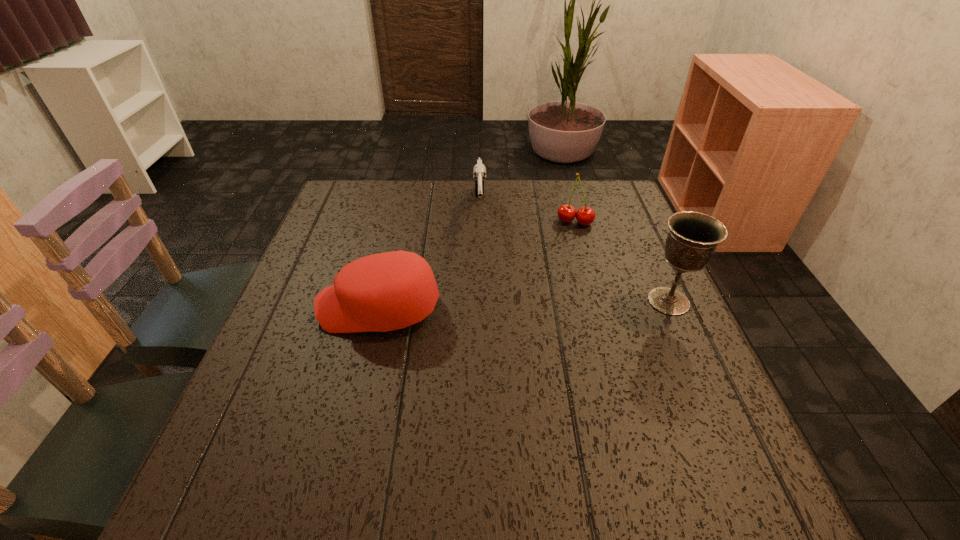
At what (x,y) coordinates should I click in order to perform the action: click on vacant space situated at the muzzle of the second object from left to right. Please return your answer as a coordinate pair (x, y). This screenshot has height=540, width=960. Looking at the image, I should click on (483, 284).

Where is `vacant space situated 0.220m at the muzzle of the second object from left to right`? The height and width of the screenshot is (540, 960). vacant space situated 0.220m at the muzzle of the second object from left to right is located at coordinates (484, 292).

Locate an element on the screen. cherry that is at the far edge is located at coordinates (566, 213).

You are a GUI agent. You are given a task and a screenshot of the screen. Output one action in this format:
    pyautogui.click(x=<x>, y=<y>)
    Task: Click on the gun that is at the far edge
    The width and height of the screenshot is (960, 540).
    Given the screenshot: What is the action you would take?
    pyautogui.click(x=479, y=171)

Identify the location of object that is positioned at the left edge. (382, 292).

You are a GUI agent. You are given a task and a screenshot of the screen. Output one action in this format:
    pyautogui.click(x=<x>, y=<y>)
    Task: Click on the chalice located in the right edge section of the desktop
    The image size is (960, 540).
    Given the screenshot: What is the action you would take?
    pyautogui.click(x=693, y=237)

At what (x,y) coordinates should I click in order to perform the action: click on cherry that is at the right edge. Please return your answer as a coordinate pair (x, y). Looking at the image, I should click on (566, 213).

The width and height of the screenshot is (960, 540). I want to click on object present at the far right corner, so click(x=566, y=213).

This screenshot has width=960, height=540. What are the coordinates of `blank space at the far edge of the desktop` in the screenshot? It's located at (509, 185).

At what (x,y) coordinates should I click in order to perform the action: click on blank space at the left edge. Please return your answer as a coordinate pair (x, y). Image resolution: width=960 pixels, height=540 pixels. Looking at the image, I should click on (282, 400).